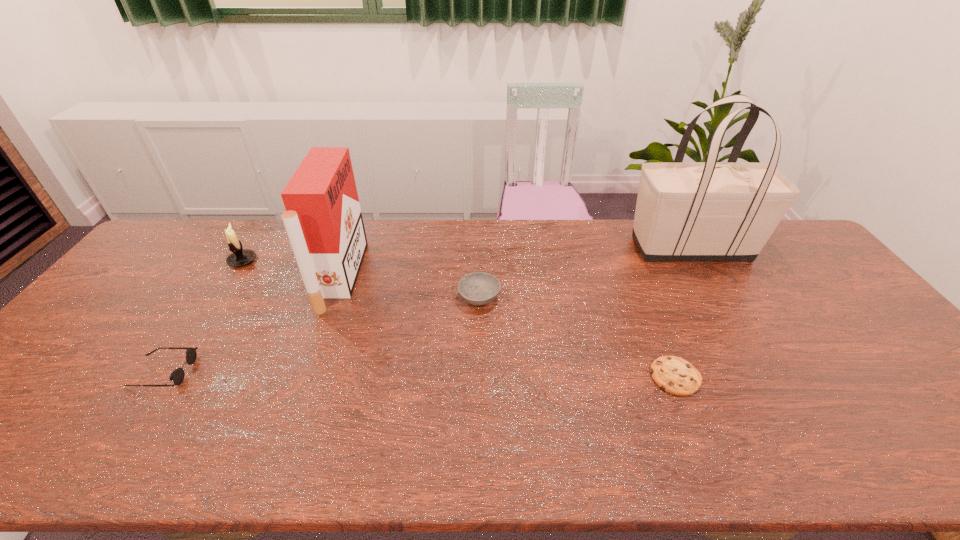
This screenshot has height=540, width=960. In the image, there is a desktop. In order to click on free space at the left edge in this screenshot , I will do `click(188, 266)`.

Where is `vacant point at the right edge`? The image size is (960, 540). vacant point at the right edge is located at coordinates (836, 332).

You are a GUI agent. You are given a task and a screenshot of the screen. Output one action in this format:
    pyautogui.click(x=<x>, y=<y>)
    Task: Click on the vacant area at the far left corner of the desktop
    
    Given the screenshot: What is the action you would take?
    pyautogui.click(x=166, y=252)

This screenshot has width=960, height=540. What are the coordinates of `free space between the shopping bag and the second shortest object` in the screenshot? It's located at (426, 310).

This screenshot has width=960, height=540. Find the location of `free space between the cookie and the sunglasses`. free space between the cookie and the sunglasses is located at coordinates (420, 374).

Identify the location of free point between the fifth tallest object and the cigarette case. (252, 324).

Identify the location of free space between the third tallest object and the sunglasses. (203, 316).

Where is `free space between the shopping bag and the sunglasses`? This screenshot has width=960, height=540. free space between the shopping bag and the sunglasses is located at coordinates (426, 310).

You are a GUI agent. You are given a task and a screenshot of the screen. Output one action in this format:
    pyautogui.click(x=<x>, y=<y>)
    Task: Click on the vacant area between the candle holder and the second tallest object
    The height and width of the screenshot is (540, 960).
    Given the screenshot: What is the action you would take?
    pyautogui.click(x=292, y=268)

Locate an element on the screen. The height and width of the screenshot is (540, 960). free area in between the cookie and the sunglasses is located at coordinates (420, 374).